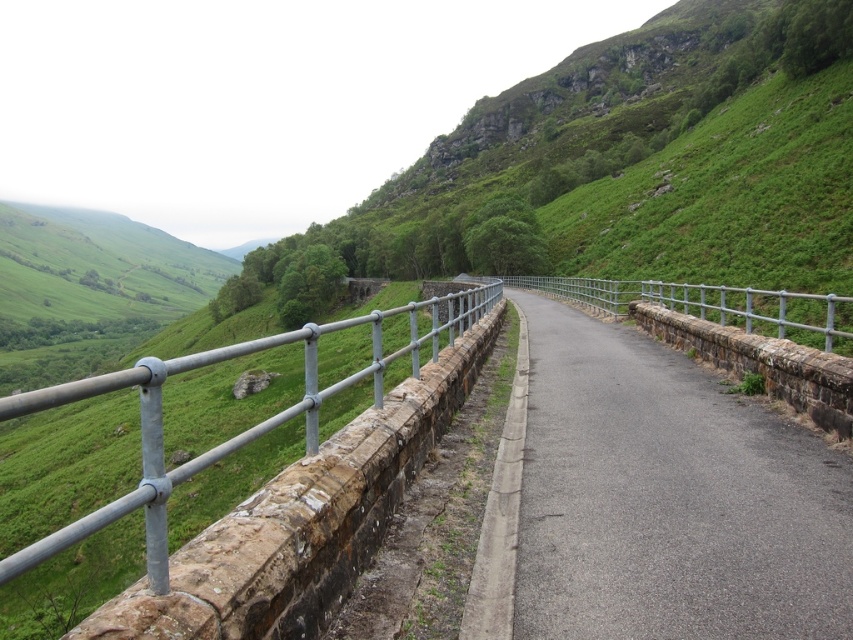
You are a hiker standing at the point labeled point (331, 557). You want to reach the point labeled point (772, 504). Which direction should you move relative to the current position?

You should move backward to reach point (772, 504) because it is behind point (331, 557) from your current position.

You are driving a delivery truck that is 2.5 meters wide. You need to navigate through the asphalt road at center which is bordered by a silver metallic fence at center. Can your truck safely pass between them without touching the fence?

The distance between the asphalt road at center and the silver metallic fence at center is 9.82 meters. Since the truck is only 2.5 meters wide, there is ample space for it to pass safely without touching the fence.